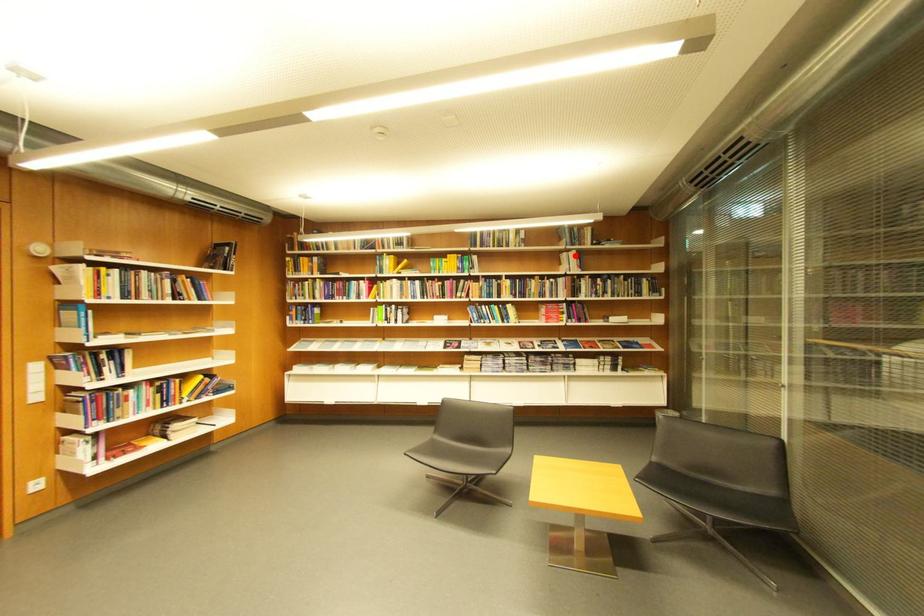
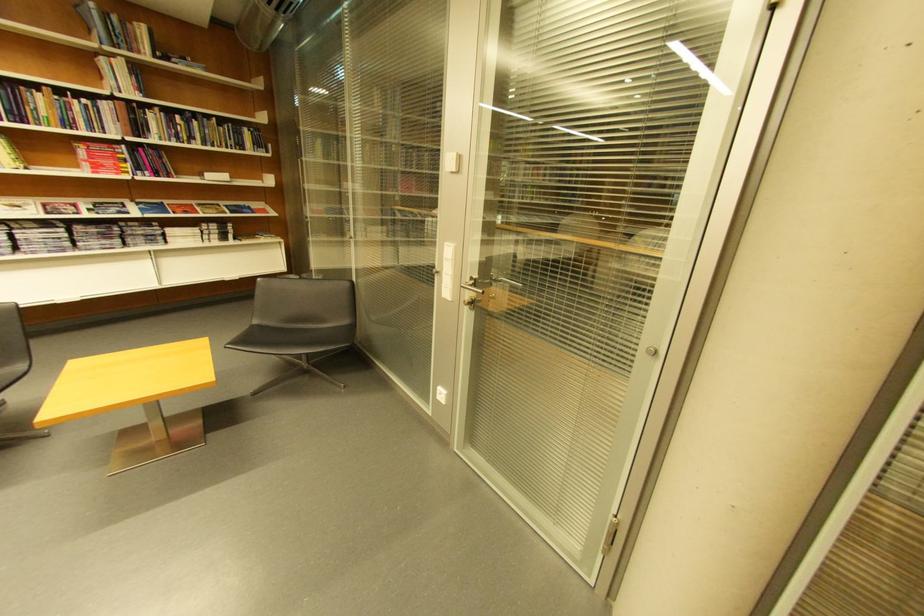
Question: A red point is marked in image1. In image2, is the corresponding 3D point closer to the camera or farther? Reply with the corresponding letter.

Choices:
 (A) The corresponding 3D point is closer.
 (B) The corresponding 3D point is farther.

Answer: (B)